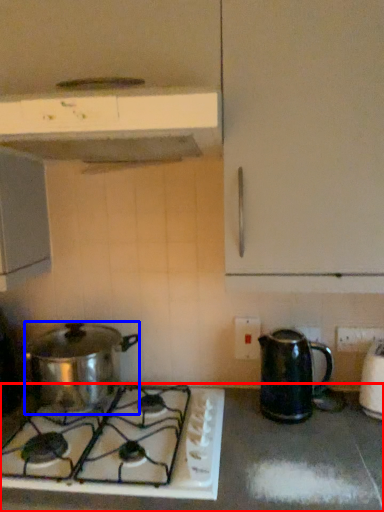
Question: Which point is further to the camera, countertop (highlighted by a red box) or kitchen appliance (highlighted by a blue box)?

Choices:
 (A) countertop
 (B) kitchen appliance

Answer: (B)